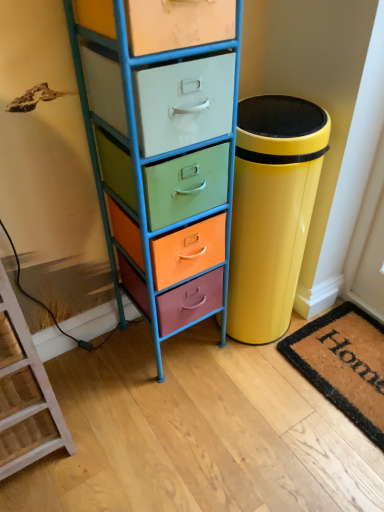
Find the location of a particular element. free space to the left of metallic multi-colored chest of drawers at left is located at coordinates (96, 366).